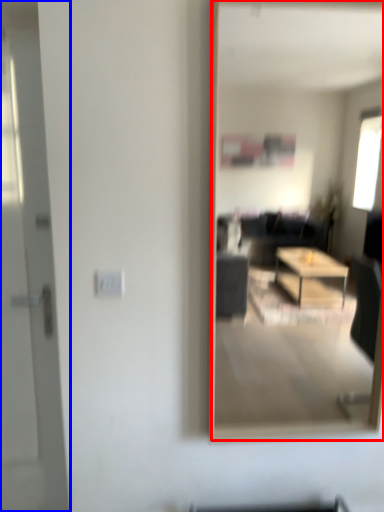
Question: Among these objects, which one is farthest to the camera, mirror (highlighted by a red box) or door (highlighted by a blue box)?

Choices:
 (A) mirror
 (B) door

Answer: (B)